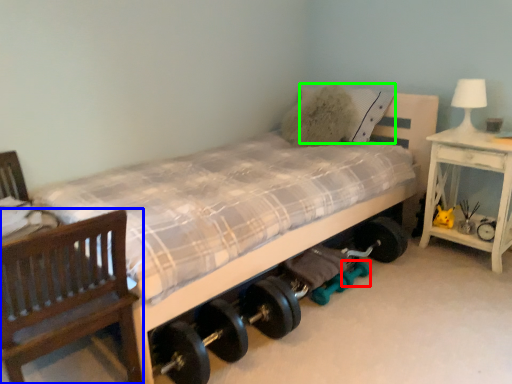
Question: Considering the real-world distances, which object is closest to dumbbell (highlighted by a red box)? chair (highlighted by a blue box) or pillow (highlighted by a green box).

Choices:
 (A) chair
 (B) pillow

Answer: (B)